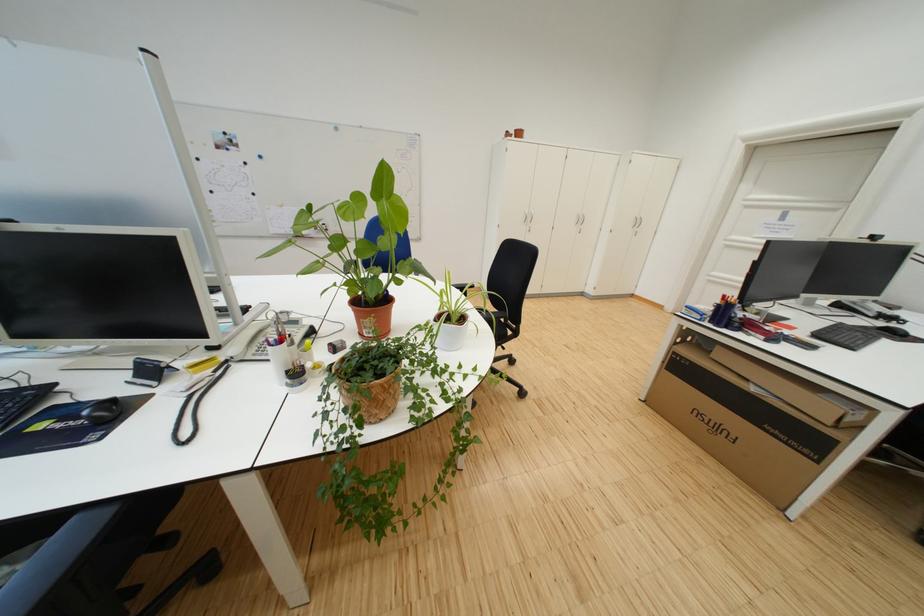
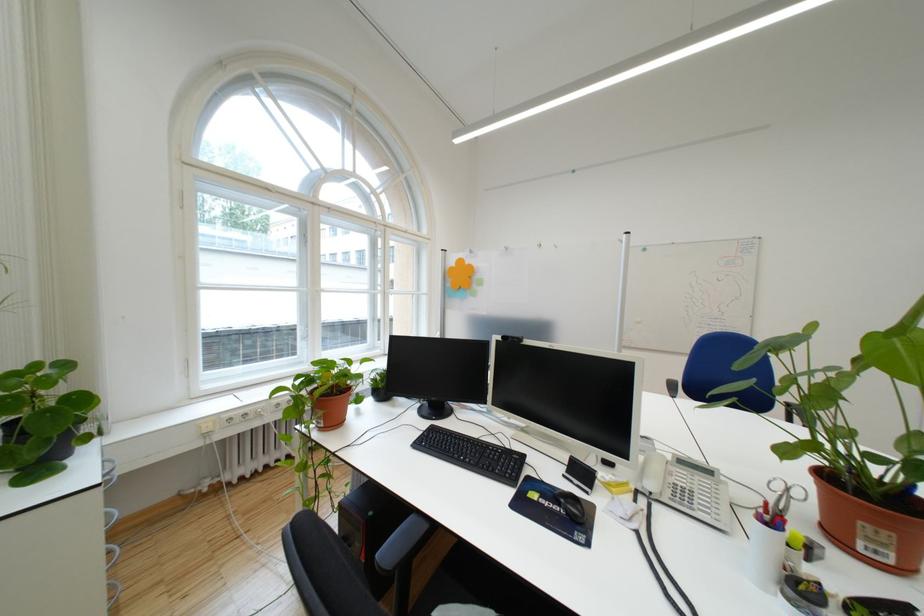
Question: How did the camera likely rotate?

Choices:
 (A) Left
 (B) Right
 (C) Up
 (D) Down

Answer: (A)